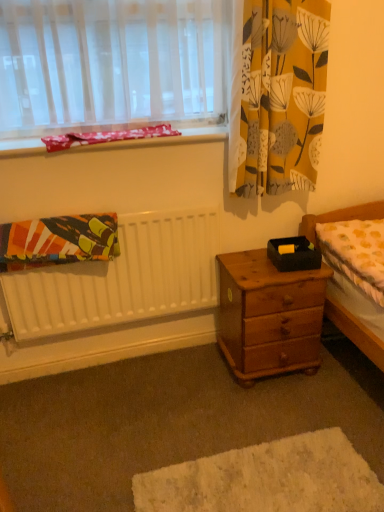
Question: Considering the positions of wooden nightstand at center and pink fabric at upper left in the image, is wooden nightstand at center wider or thinner than pink fabric at upper left?

Choices:
 (A) thin
 (B) wide

Answer: (B)

Question: Is wooden nightstand at center bigger or smaller than pink fabric at upper left?

Choices:
 (A) big
 (B) small

Answer: (A)

Question: Estimate the real-world distances between objects in this image. Which object is farther from the pink fabric at upper left?

Choices:
 (A) white matte radiator at left
 (B) yellow dotted fabric at right
 (C) yellow floral fabric at upper right
 (D) textured cotton blanket at left
 (E) wooden drawer at lower right

Answer: (E)

Question: Estimate the real-world distances between objects in this image. Which object is farther from the yellow floral fabric at upper right?

Choices:
 (A) pink fabric at upper left
 (B) textured cotton blanket at left
 (C) wooden drawer at lower right
 (D) white matte radiator at left
 (E) wooden nightstand at center

Answer: (C)